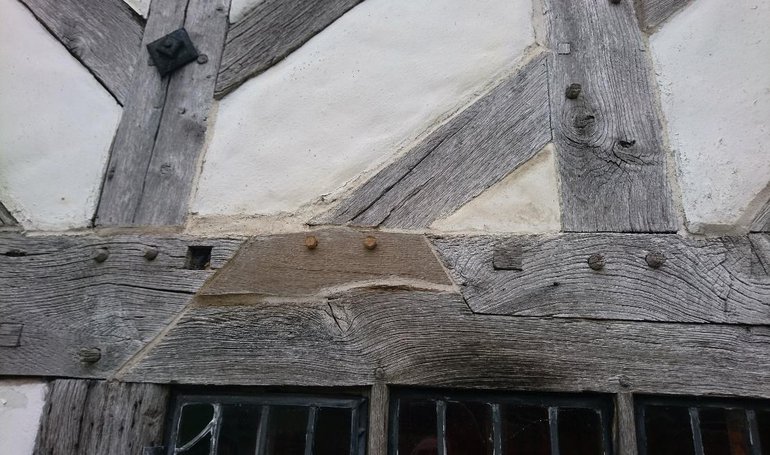
Where is `vertical boards`? This screenshot has width=770, height=455. vertical boards is located at coordinates (142, 129), (608, 110), (88, 423).